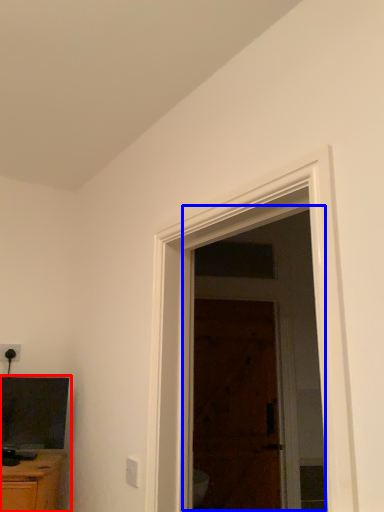
Question: Which object appears farthest to the camera in this image, entertainment center (highlighted by a red box) or screen door (highlighted by a blue box)?

Choices:
 (A) entertainment center
 (B) screen door

Answer: (B)